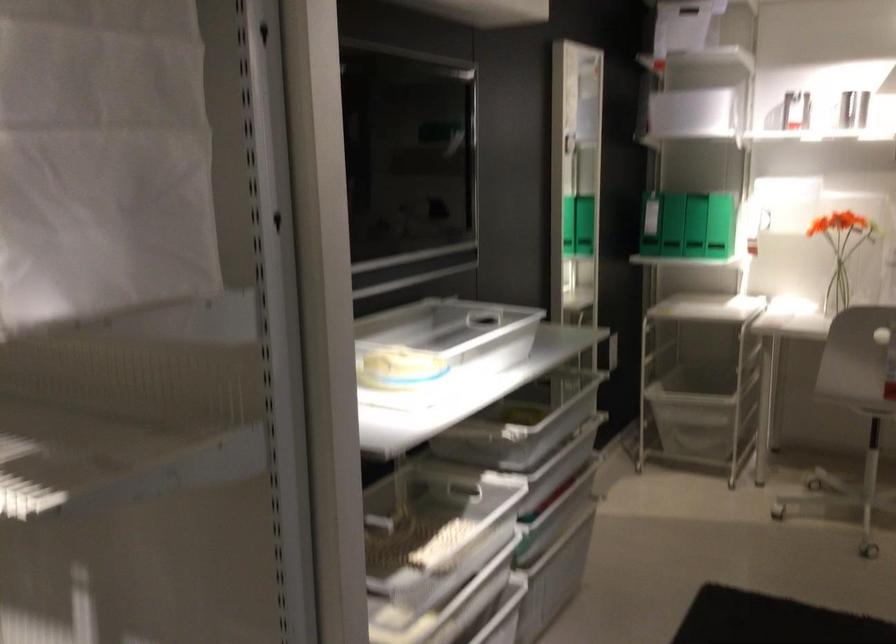
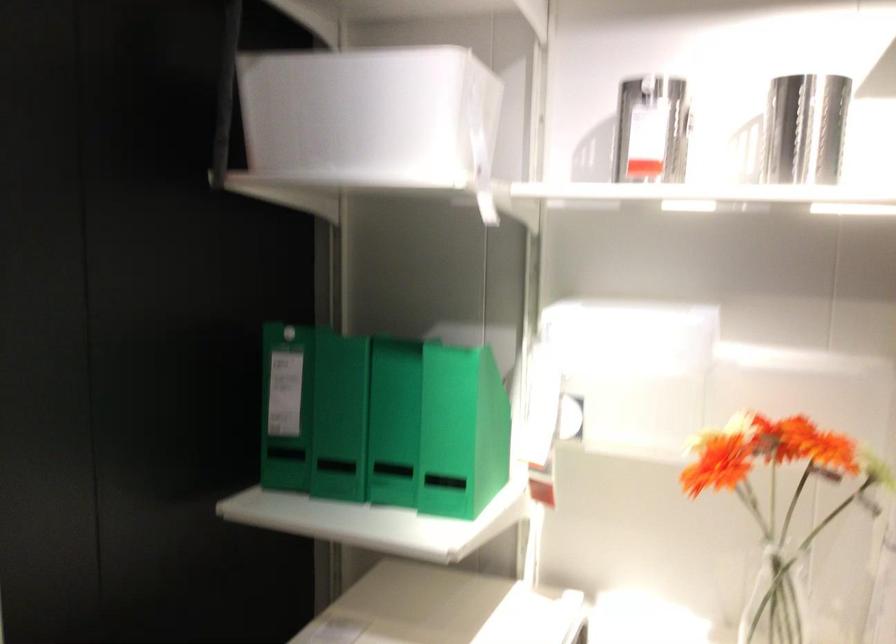
Find the pixel in the second image that matches (x=682, y=204) in the first image.

(286, 406)